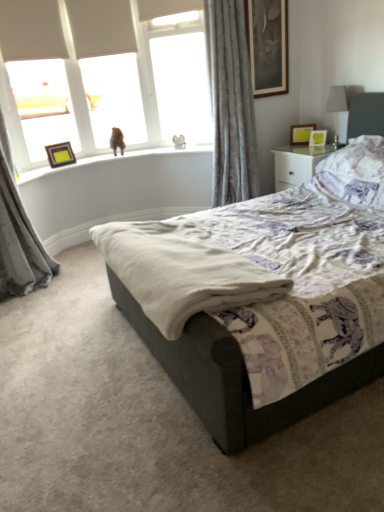
Find the location of a particular element. The image size is (384, 512). free space in front of matte yellow picture frame at upper right, marked as the first picture frame in a right-to-left arrangement is located at coordinates (322, 147).